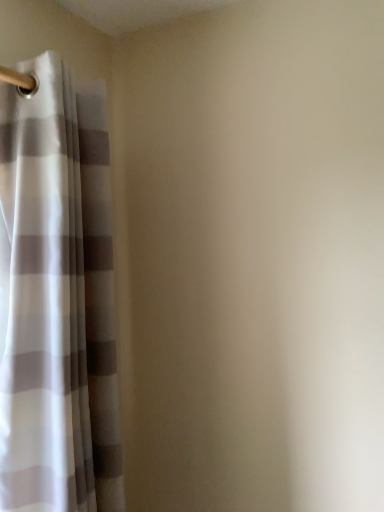
Question: Should I look upward or downward to see translucent white and gray striped curtain at left?

Choices:
 (A) up
 (B) down

Answer: (B)